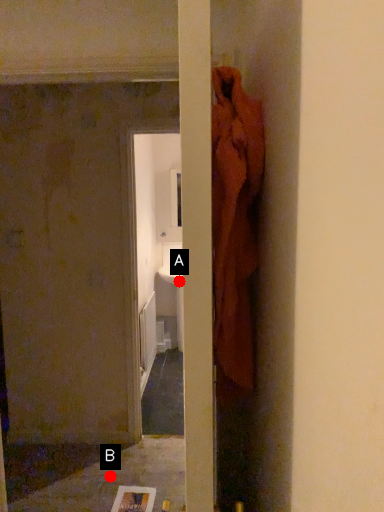
Question: Two points are circled on the image, labeled by A and B beside each circle. Which point is further to the camera?

Choices:
 (A) A is further
 (B) B is further

Answer: (A)